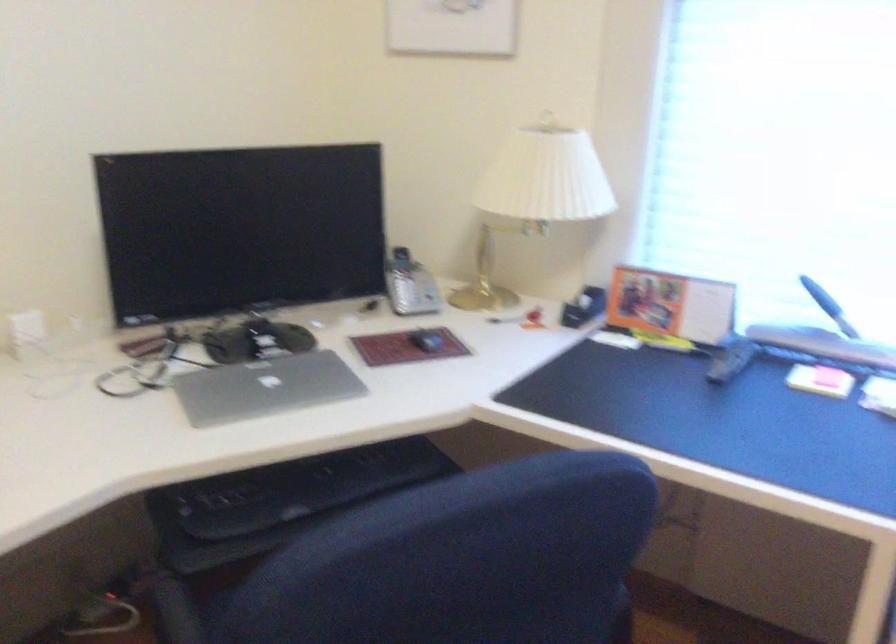
Describe the element at coordinates (220, 581) in the screenshot. The image size is (896, 644). I see `the blue chair sitting surface` at that location.